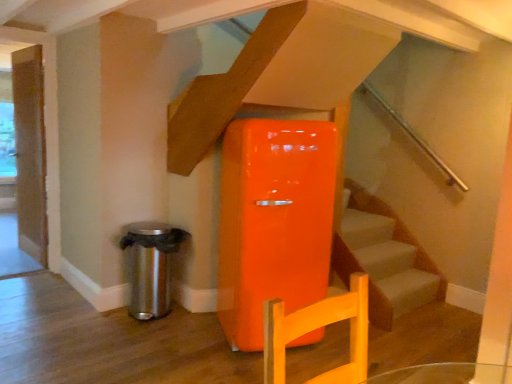
Identify the location of free space in front of polished stainless steel trash can at lower left. This screenshot has height=384, width=512. (117, 335).